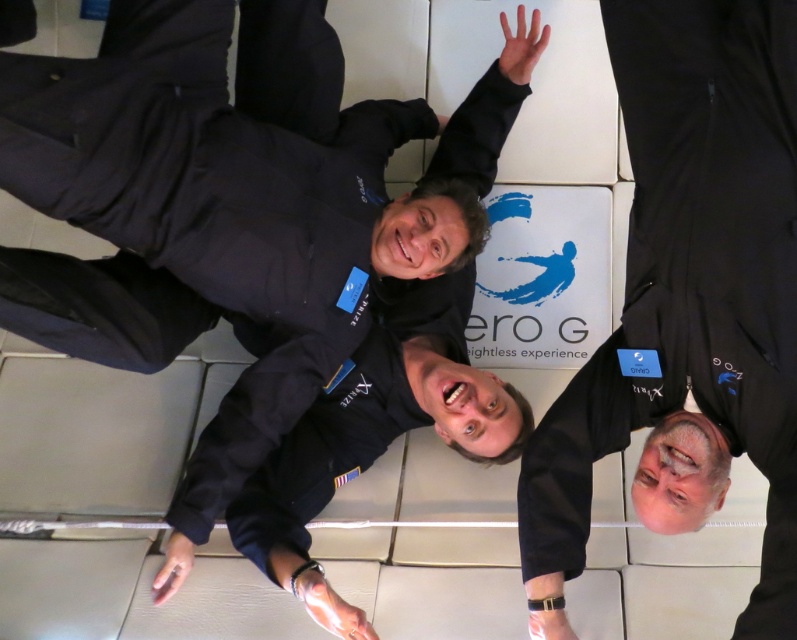
Question: Which point is closer to the camera taking this photo?

Choices:
 (A) (721, 483)
 (B) (84, 301)

Answer: (A)

Question: Is matte black suit at upper center above black matte jumpsuit at upper right?

Choices:
 (A) no
 (B) yes

Answer: (B)

Question: Does matte black suit at upper center lie behind black matte jumpsuit at upper right?

Choices:
 (A) yes
 (B) no

Answer: (A)

Question: Which of the following is the closest to the observer?

Choices:
 (A) matte black suit at upper center
 (B) black matte jumpsuit at upper right

Answer: (B)

Question: Can you confirm if matte black suit at upper center is wider than black matte jumpsuit at upper right?

Choices:
 (A) no
 (B) yes

Answer: (B)